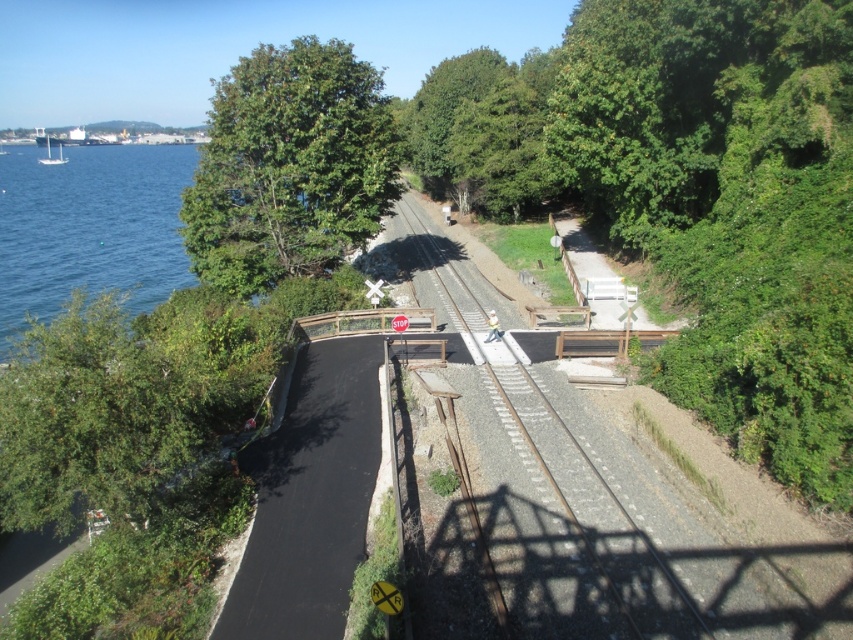
Question: Does smooth metal train track at center have a smaller size compared to green leafy tree at upper left?

Choices:
 (A) yes
 (B) no

Answer: (B)

Question: Does smooth metal train track at center have a greater width compared to green leafy tree at upper left?

Choices:
 (A) no
 (B) yes

Answer: (A)

Question: Which point is closer to the camera?

Choices:
 (A) (419, 275)
 (B) (192, 253)

Answer: (B)

Question: Can you confirm if smooth metal train track at center is bigger than green leafy tree at upper left?

Choices:
 (A) no
 (B) yes

Answer: (B)